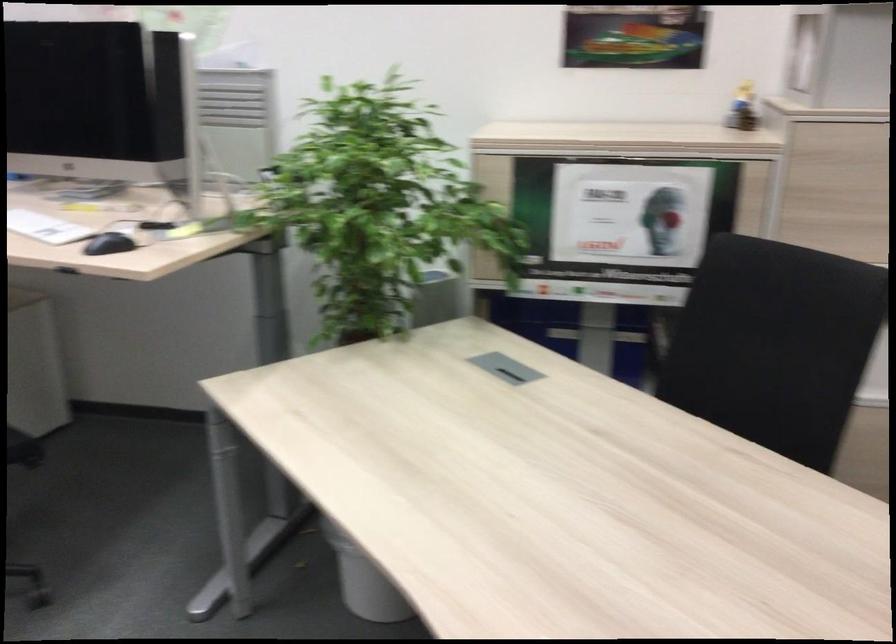
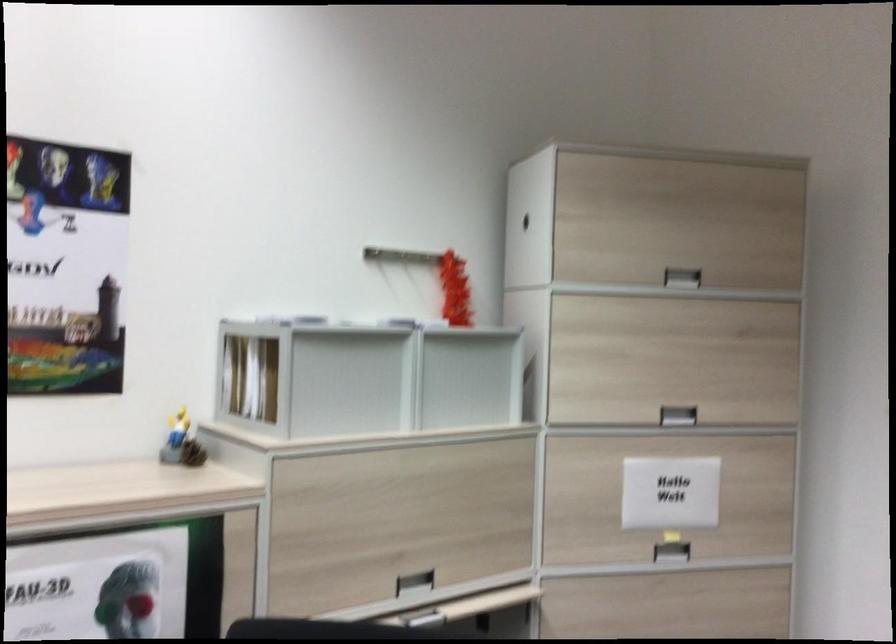
In the second image, find the point that corresponds to pixel 743 106 in the first image.

(181, 442)